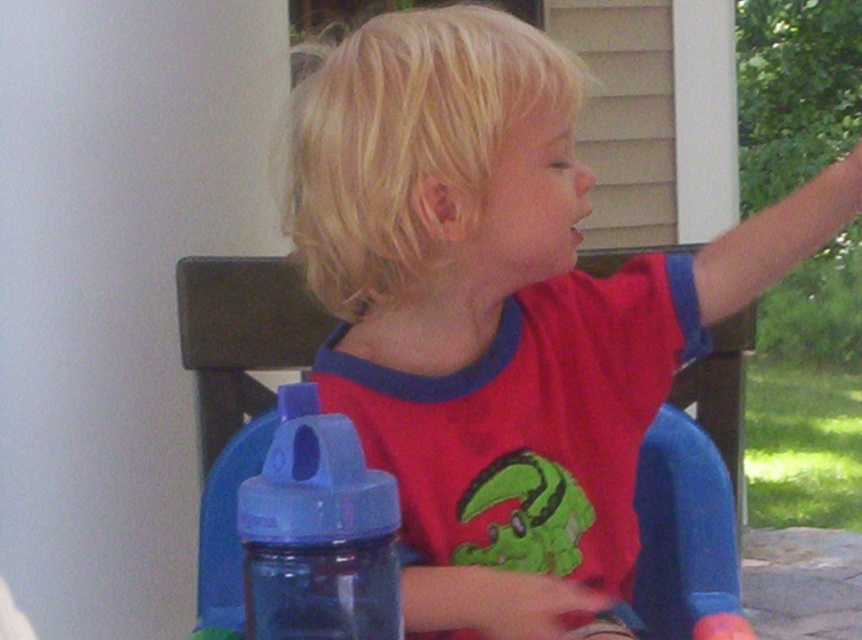
Which is more to the left, blue plastic chair at center or blue plastic bottle at lower left?

blue plastic bottle at lower left

Is point (282, 324) positioned behind point (334, 572)?

Yes, point (282, 324) is behind point (334, 572).

At what (x,y) coordinates should I click in order to perform the action: click on blue plastic chair at center. Please return your answer as a coordinate pair (x, y). The image size is (862, 640). Looking at the image, I should click on (236, 401).

Does matte plastic child at center have a larger size compared to blue plastic chair at center?

Indeed, matte plastic child at center has a larger size compared to blue plastic chair at center.

Consider the image. Who is higher up, matte plastic child at center or blue plastic chair at center?

matte plastic child at center is above.

Locate an element on the screen. The height and width of the screenshot is (640, 862). matte plastic child at center is located at coordinates (498, 310).

This screenshot has width=862, height=640. In order to click on matte plastic child at center in this screenshot , I will do `click(498, 310)`.

Based on the photo, does matte plastic child at center have a greater width compared to blue plastic bottle at lower left?

Yes, matte plastic child at center is wider than blue plastic bottle at lower left.

Does matte plastic child at center have a greater height compared to blue plastic bottle at lower left?

Yes.

Between point (534, 177) and point (286, 541), which one is positioned behind?

Positioned behind is point (534, 177).

Identify the location of matte plastic child at center. (498, 310).